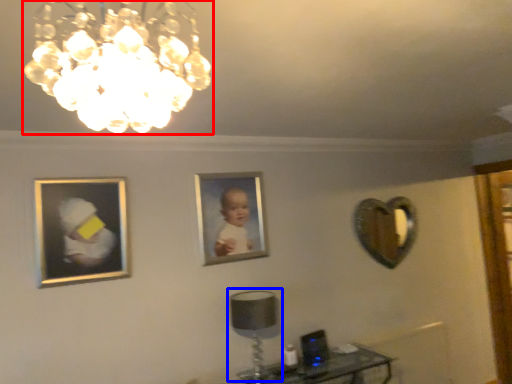
Question: Which object appears farthest to the camera in this image, lamp (highlighted by a red box) or table lamp (highlighted by a blue box)?

Choices:
 (A) lamp
 (B) table lamp

Answer: (B)